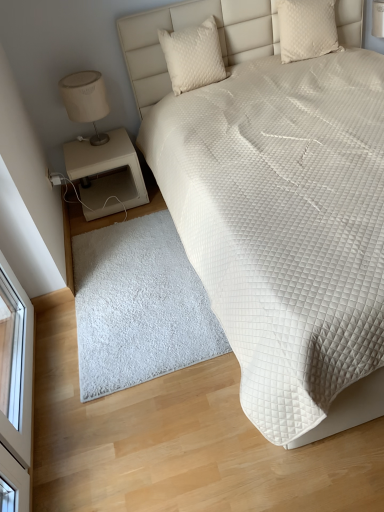
This screenshot has width=384, height=512. What do you see at coordinates (86, 100) in the screenshot?
I see `matte beige lampshade at left` at bounding box center [86, 100].

This screenshot has height=512, width=384. Describe the element at coordinates (306, 29) in the screenshot. I see `white quilted pillow at upper right, arranged as the first pillow when viewed from the right` at that location.

The image size is (384, 512). What do you see at coordinates (138, 306) in the screenshot?
I see `white fluffy rug at lower center` at bounding box center [138, 306].

Find the location of a particular element. quilted cream pillow at upper center, arranged as the second pillow when viewed from the right is located at coordinates (193, 56).

This screenshot has width=384, height=512. What are the coordinates of `beige matte nightstand at lower left` in the screenshot? It's located at (106, 174).

Considering the positions of objects white quilted pillow at upper right, arranged as the first pillow when viewed from the right, and quilted cream pillow at upper center, arranged as the second pillow when viewed from the right, in the image provided, who is in front, white quilted pillow at upper right, arranged as the first pillow when viewed from the right, or quilted cream pillow at upper center, arranged as the second pillow when viewed from the right,?

quilted cream pillow at upper center, arranged as the second pillow when viewed from the right, is closer to the camera.

Considering the relative sizes of white quilted pillow at upper right, arranged as the first pillow when viewed from the right, and quilted cream pillow at upper center, the 1th pillow positioned from the left, in the image provided, is white quilted pillow at upper right, arranged as the first pillow when viewed from the right, taller than quilted cream pillow at upper center, the 1th pillow positioned from the left,?

In fact, white quilted pillow at upper right, arranged as the first pillow when viewed from the right, may be shorter than quilted cream pillow at upper center, the 1th pillow positioned from the left.

Is white quilted pillow at upper right, marked as the 2th pillow in a left-to-right arrangement, bigger than quilted cream pillow at upper center, arranged as the second pillow when viewed from the right?

Correct, white quilted pillow at upper right, marked as the 2th pillow in a left-to-right arrangement, is larger in size than quilted cream pillow at upper center, arranged as the second pillow when viewed from the right.

From the image's perspective, which one is positioned lower, white quilted pillow at upper right, arranged as the first pillow when viewed from the right, or quilted cream pillow at upper center, arranged as the second pillow when viewed from the right?

From the image's view, quilted cream pillow at upper center, arranged as the second pillow when viewed from the right, is below.

Could you tell me if white fluffy rug at lower center is facing matte beige lampshade at left?

No, white fluffy rug at lower center is not facing towards matte beige lampshade at left.

Can you confirm if white fluffy rug at lower center is wider than matte beige lampshade at left?

Result: Indeed, white fluffy rug at lower center has a greater width compared to matte beige lampshade at left.

Considering the relative sizes of white fluffy rug at lower center and matte beige lampshade at left in the image provided, is white fluffy rug at lower center shorter than matte beige lampshade at left?

Indeed, white fluffy rug at lower center has a lesser height compared to matte beige lampshade at left.

How different are the orientations of beige matte nightstand at lower left and white fluffy rug at lower center in degrees?

→ 2.08 degrees separate the facing orientations of beige matte nightstand at lower left and white fluffy rug at lower center.

Which is correct: beige matte nightstand at lower left is inside white fluffy rug at lower center, or outside of it?

beige matte nightstand at lower left is located beyond the bounds of white fluffy rug at lower center.

Considering the relative sizes of beige matte nightstand at lower left and white fluffy rug at lower center in the image provided, is beige matte nightstand at lower left taller than white fluffy rug at lower center?

Yes.

Considering the sizes of beige matte nightstand at lower left and white fluffy rug at lower center in the image, is beige matte nightstand at lower left bigger or smaller than white fluffy rug at lower center?

Clearly, beige matte nightstand at lower left is larger in size than white fluffy rug at lower center.

From the image's perspective, between white fluffy rug at lower center and beige matte nightstand at lower left, who is located below?

white fluffy rug at lower center is shown below in the image.

In terms of width, does white fluffy rug at lower center look wider or thinner when compared to beige matte nightstand at lower left?

Considering their sizes, white fluffy rug at lower center looks broader than beige matte nightstand at lower left.

Identify the location of mat below the beige matte nightstand at lower left (from a real-world perspective). Image resolution: width=384 pixels, height=512 pixels. 138,306.

Is white fluffy rug at lower center bigger than beige matte nightstand at lower left?

Incorrect, white fluffy rug at lower center is not larger than beige matte nightstand at lower left.

Measure the distance between matte beige lampshade at left and quilted cream pillow at upper center, arranged as the second pillow when viewed from the right.

matte beige lampshade at left and quilted cream pillow at upper center, arranged as the second pillow when viewed from the right, are 20.59 inches apart from each other.

In the image, is matte beige lampshade at left positioned in front of or behind quilted cream pillow at upper center, arranged as the second pillow when viewed from the right?

matte beige lampshade at left is behind quilted cream pillow at upper center, arranged as the second pillow when viewed from the right.

What's the angular difference between matte beige lampshade at left and quilted cream pillow at upper center, arranged as the second pillow when viewed from the right,'s facing directions?

The facing directions of matte beige lampshade at left and quilted cream pillow at upper center, arranged as the second pillow when viewed from the right, are 0.776 degrees apart.

Can you see matte beige lampshade at left touching quilted cream pillow at upper center, arranged as the second pillow when viewed from the right?

No.

In terms of height, does white quilted bed at upper right look taller or shorter compared to white quilted pillow at upper right, arranged as the first pillow when viewed from the right?

Considering their sizes, white quilted bed at upper right has more height than white quilted pillow at upper right, arranged as the first pillow when viewed from the right.

Is white quilted bed at upper right positioned with its back to white quilted pillow at upper right, arranged as the first pillow when viewed from the right?

Yes, white quilted pillow at upper right, arranged as the first pillow when viewed from the right, is at the back of white quilted bed at upper right.

From the image's perspective, is white quilted bed at upper right below white quilted pillow at upper right, marked as the 2th pillow in a left-to-right arrangement?

Yes.

From the picture: Is white quilted bed at upper right taller than white fluffy rug at lower center?

Yes, white quilted bed at upper right is taller than white fluffy rug at lower center.

Is white quilted bed at upper right positioned with its back to white fluffy rug at lower center?

white quilted bed at upper right is not turned away from white fluffy rug at lower center.

Which is behind, point (202, 246) or point (92, 240)?

Point (92, 240)

Image resolution: width=384 pixels, height=512 pixels. I want to click on pillow lying on the left of white quilted pillow at upper right, marked as the 2th pillow in a left-to-right arrangement, so (x=193, y=56).

Where is `table lamp above the white fluffy rug at lower center (from a real-world perspective)`? table lamp above the white fluffy rug at lower center (from a real-world perspective) is located at coordinates (86, 100).

Which object lies nearer to the anchor point matte beige lampshade at left, white quilted pillow at upper right, marked as the 2th pillow in a left-to-right arrangement, or quilted cream pillow at upper center, arranged as the second pillow when viewed from the right?

quilted cream pillow at upper center, arranged as the second pillow when viewed from the right, is closer to matte beige lampshade at left.

Based on their spatial positions, is white quilted bed at upper right or white fluffy rug at lower center closer to white quilted pillow at upper right, marked as the 2th pillow in a left-to-right arrangement?

white quilted bed at upper right is positioned closer to the anchor white quilted pillow at upper right, marked as the 2th pillow in a left-to-right arrangement.

Consider the image. Looking at the image, which one is located further to white fluffy rug at lower center, beige matte nightstand at lower left or quilted cream pillow at upper center, arranged as the second pillow when viewed from the right?

The object further to white fluffy rug at lower center is quilted cream pillow at upper center, arranged as the second pillow when viewed from the right.

Estimate the real-world distances between objects in this image. Which object is closer to beige matte nightstand at lower left, white quilted pillow at upper right, marked as the 2th pillow in a left-to-right arrangement, or white quilted bed at upper right?

white quilted bed at upper right is positioned closer to the anchor beige matte nightstand at lower left.

From the image, which object appears to be nearer to white fluffy rug at lower center, white quilted bed at upper right or quilted cream pillow at upper center, arranged as the second pillow when viewed from the right?

The object closer to white fluffy rug at lower center is white quilted bed at upper right.

From the picture: Which object lies nearer to the anchor point white quilted pillow at upper right, marked as the 2th pillow in a left-to-right arrangement, quilted cream pillow at upper center, arranged as the second pillow when viewed from the right, or matte beige lampshade at left?

Among the two, quilted cream pillow at upper center, arranged as the second pillow when viewed from the right, is located nearer to white quilted pillow at upper right, marked as the 2th pillow in a left-to-right arrangement.

Estimate the real-world distances between objects in this image. Which object is further from white fluffy rug at lower center, quilted cream pillow at upper center, the 1th pillow positioned from the left, or beige matte nightstand at lower left?

quilted cream pillow at upper center, the 1th pillow positioned from the left, is positioned further to the anchor white fluffy rug at lower center.

Considering their positions, is beige matte nightstand at lower left positioned further to quilted cream pillow at upper center, the 1th pillow positioned from the left, than matte beige lampshade at left?

Among the two, beige matte nightstand at lower left is located further to quilted cream pillow at upper center, the 1th pillow positioned from the left.

Where is `nightstand between quilted cream pillow at upper center, arranged as the second pillow when viewed from the right, and white fluffy rug at lower center, in the vertical direction`? The width and height of the screenshot is (384, 512). nightstand between quilted cream pillow at upper center, arranged as the second pillow when viewed from the right, and white fluffy rug at lower center, in the vertical direction is located at coordinates (106, 174).

Where is `mat between white quilted bed at upper right and quilted cream pillow at upper center, arranged as the second pillow when viewed from the right, along the z-axis`? mat between white quilted bed at upper right and quilted cream pillow at upper center, arranged as the second pillow when viewed from the right, along the z-axis is located at coordinates (138, 306).

This screenshot has width=384, height=512. Identify the location of mat between white quilted bed at upper right and white quilted pillow at upper right, arranged as the first pillow when viewed from the right, in the front-back direction. (138, 306).

Find the location of a particular element. table lamp that lies between white quilted pillow at upper right, marked as the 2th pillow in a left-to-right arrangement, and white fluffy rug at lower center from top to bottom is located at coordinates (86, 100).